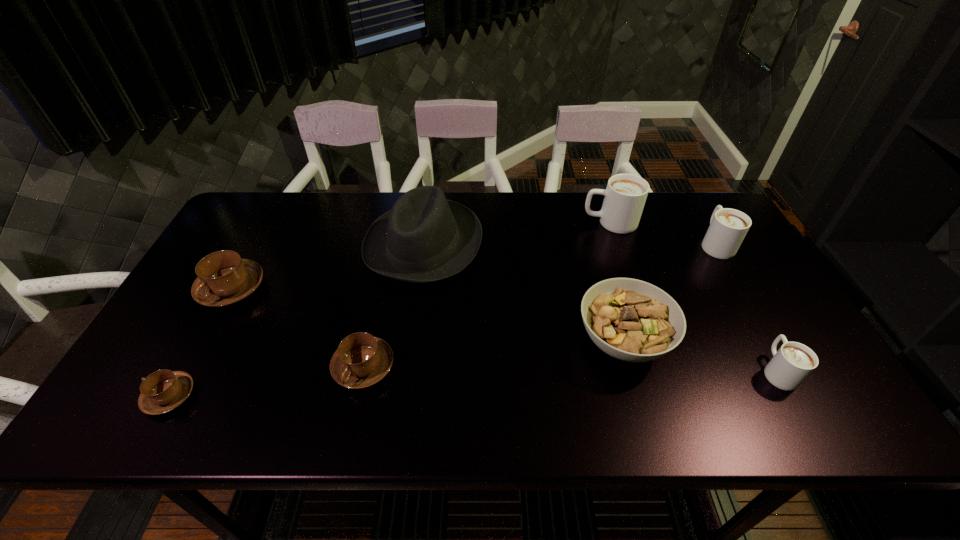
Where is `the shortest cappuccino`? the shortest cappuccino is located at coordinates (162, 391).

Where is `the shortest object`? This screenshot has height=540, width=960. the shortest object is located at coordinates (162, 391).

You are a GUI agent. You are given a task and a screenshot of the screen. Output one action in this format:
    pyautogui.click(x=<x>, y=<y>)
    Task: Click on the vacant point located 0.300m on the right of the gray fedora
    This screenshot has height=540, width=960.
    Given the screenshot: What is the action you would take?
    pyautogui.click(x=581, y=244)

Locate an element on the screen. This screenshot has width=960, height=540. vacant space positioned on the side with the handle of the tallest cappuccino is located at coordinates (519, 222).

At what (x,y) coordinates should I click in order to perform the action: click on free region located on the side with the handle of the tallest cappuccino. Please return your answer as a coordinate pair (x, y). This screenshot has height=540, width=960. Looking at the image, I should click on (464, 222).

Image resolution: width=960 pixels, height=540 pixels. Find the location of `vacant space situated on the side with the handle of the tallest cappuccino`. vacant space situated on the side with the handle of the tallest cappuccino is located at coordinates (519, 222).

At what (x,y) coordinates should I click in order to perform the action: click on vacant space located on the side with the handle of the second smallest white cappuccino. Please return your answer as a coordinate pair (x, y). Looking at the image, I should click on (694, 206).

In order to click on vacant space positioned on the side with the handle of the second smallest white cappuccino in this screenshot , I will do `click(695, 208)`.

Locate an element on the screen. vacant space positioned on the side with the handle of the second smallest white cappuccino is located at coordinates (686, 193).

Where is `vacant space located 0.110m on the front of the stew`? The height and width of the screenshot is (540, 960). vacant space located 0.110m on the front of the stew is located at coordinates (647, 428).